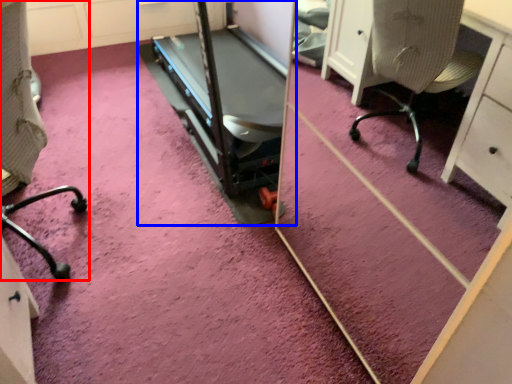
Question: Which of the following is the closest to the observer, furniture (highlighted by a red box) or treadmill (highlighted by a blue box)?

Choices:
 (A) furniture
 (B) treadmill

Answer: (A)